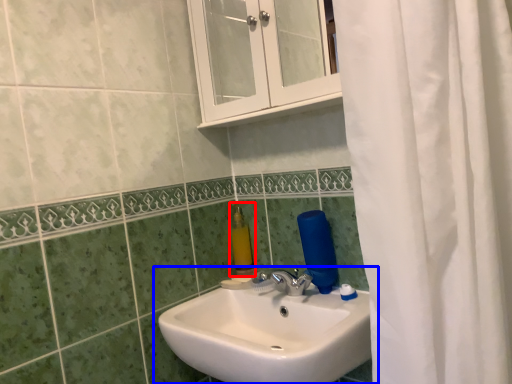
Question: Which object appears closest to the camera in this image, soap dispenser (highlighted by a red box) or sink (highlighted by a blue box)?

Choices:
 (A) soap dispenser
 (B) sink

Answer: (B)